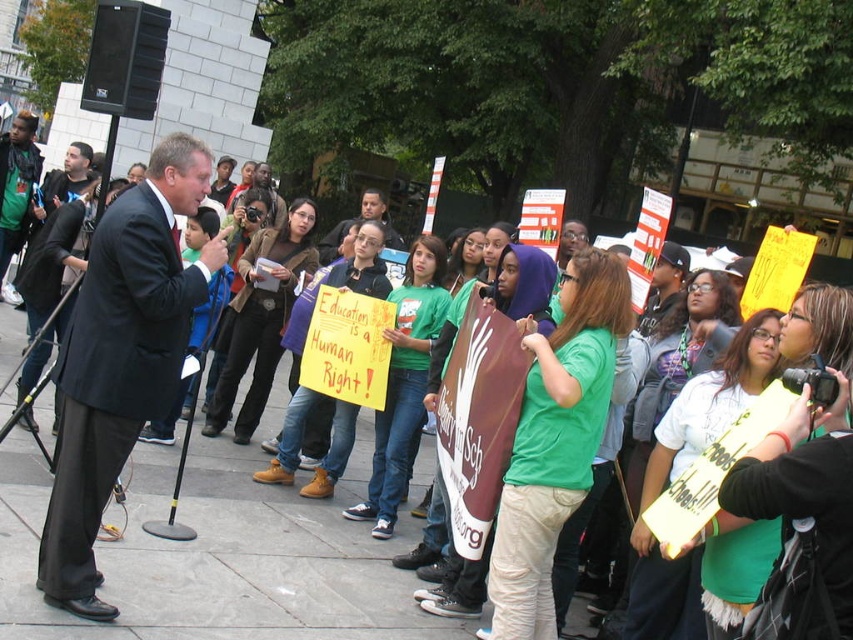
You are a photographer trying to capture a photo of the two men in the scene wearing black suits. The camera you are using has a lens that can focus on objects within a 1.2 meter width. Given that the black suit at left has a lesser width compared to matte black suit at center, can you fit both subjects into the frame without zooming in?

The black suit at left has a lesser width compared to matte black suit at center. Since the total width of both subjects combined would exceed the camera lens focus range of 1.2 meters, you cannot fit both into the frame without zooming in.